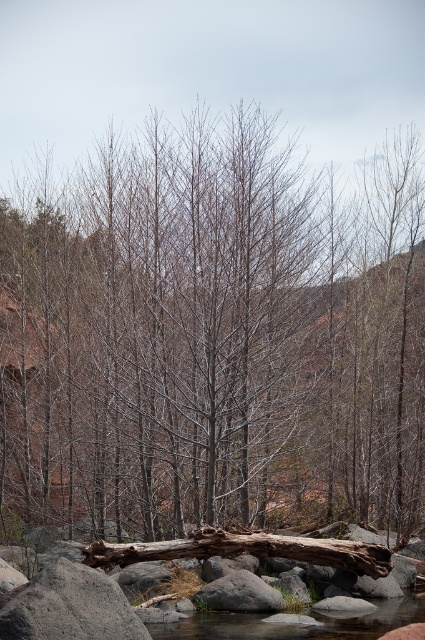
Between point (210, 531) and point (235, 595), which one is positioned in front?

Positioned in front is point (235, 595).

Can you confirm if brown rough wood log at center is positioned to the left of gray rock at center?

In fact, brown rough wood log at center is to the right of gray rock at center.

Is point (289, 548) in front of point (248, 595)?

No.

Where is `brown rough wood log at center`? The height and width of the screenshot is (640, 425). brown rough wood log at center is located at coordinates (246, 550).

In the scene shown: Can you confirm if bare branches at center is positioned above clear water at lower center?

Yes.

Looking at this image, is bare branches at center wider than clear water at lower center?

Yes.

Is point (142, 422) positioned in front of point (404, 616)?

That is False.

Identify the location of bare branches at center. This screenshot has width=425, height=640. (214, 337).

In the scene shown: Which is above, brown rough wood log at center or clear water at lower center?

brown rough wood log at center is higher up.

Can you confirm if brown rough wood log at center is positioned to the left of clear water at lower center?

No, brown rough wood log at center is not to the left of clear water at lower center.

Which is behind, point (289, 548) or point (227, 632)?

Point (289, 548)

Find the location of a particular element. brown rough wood log at center is located at coordinates (246, 550).